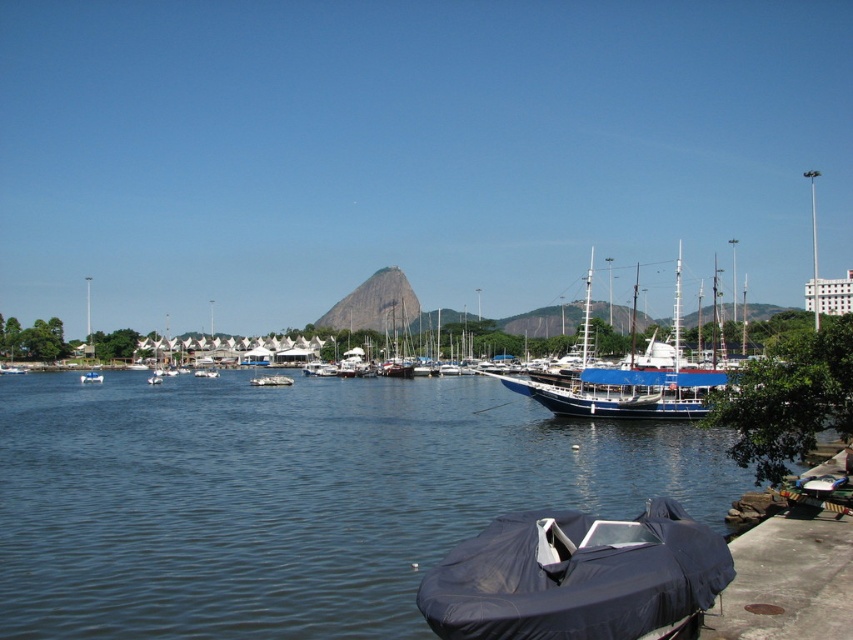
You are standing at the edge of the waterfront scene and want to determine the relative positions of two points in the image. Which point, point (596,417) or point (88,372), is closer to you?

Point (596,417) is closer to the viewer than point (88,372).

You are a photographer planning to capture a photo of the dark blue tarpaulin boat at lower center and the white matte boat at center. Given their heights, which boat should you position closer to the camera to ensure both appear equally tall in the photo?

Since the dark blue tarpaulin boat at lower center is taller than the white matte boat at center, you should position the white matte boat at center closer to the camera. This way, even though it is shorter, its proximity will make it appear the same height as the taller boat in the photo.